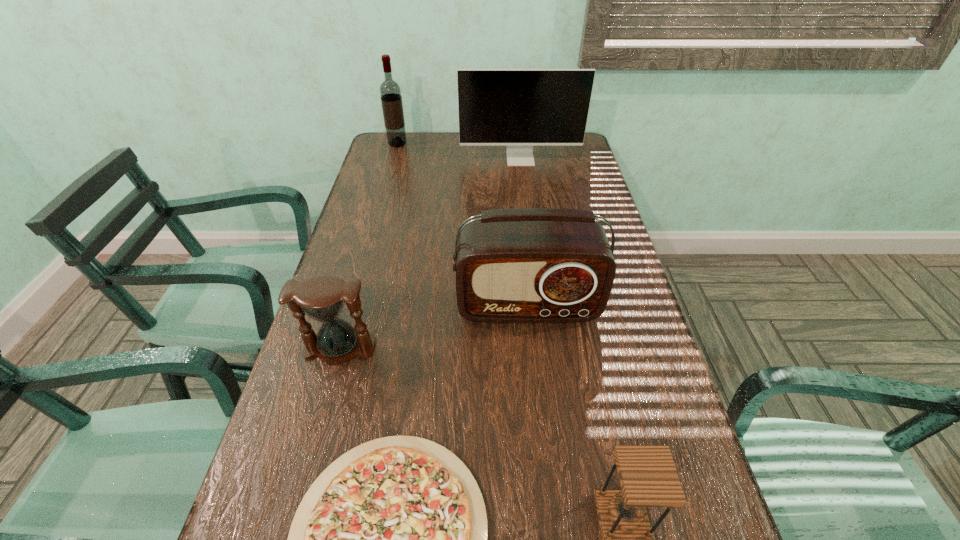
This screenshot has width=960, height=540. I want to click on monitor that is at the far edge, so click(519, 108).

At what (x,y) coordinates should I click in order to perform the action: click on wine bottle situated at the left edge. Please return your answer as a coordinate pair (x, y). Looking at the image, I should click on (390, 92).

Locate an element on the screen. hourglass located at the left edge is located at coordinates (322, 298).

I want to click on monitor positioned at the right edge, so click(519, 108).

Locate an element on the screen. radio receiver positioned at the right edge is located at coordinates (523, 265).

Find the location of a particular element. This screenshot has width=960, height=540. object that is at the far left corner is located at coordinates (390, 92).

Where is `object at the far right corner`? object at the far right corner is located at coordinates (519, 108).

The width and height of the screenshot is (960, 540). I want to click on vacant space at the far edge, so click(422, 133).

You are a GUI agent. You are given a task and a screenshot of the screen. Output one action in this format:
    pyautogui.click(x=<x>, y=<y>)
    Task: Click on the free space at the left edge
    
    Given the screenshot: What is the action you would take?
    pyautogui.click(x=265, y=518)

This screenshot has width=960, height=540. What are the coordinates of `free space at the right edge` in the screenshot? It's located at (657, 514).